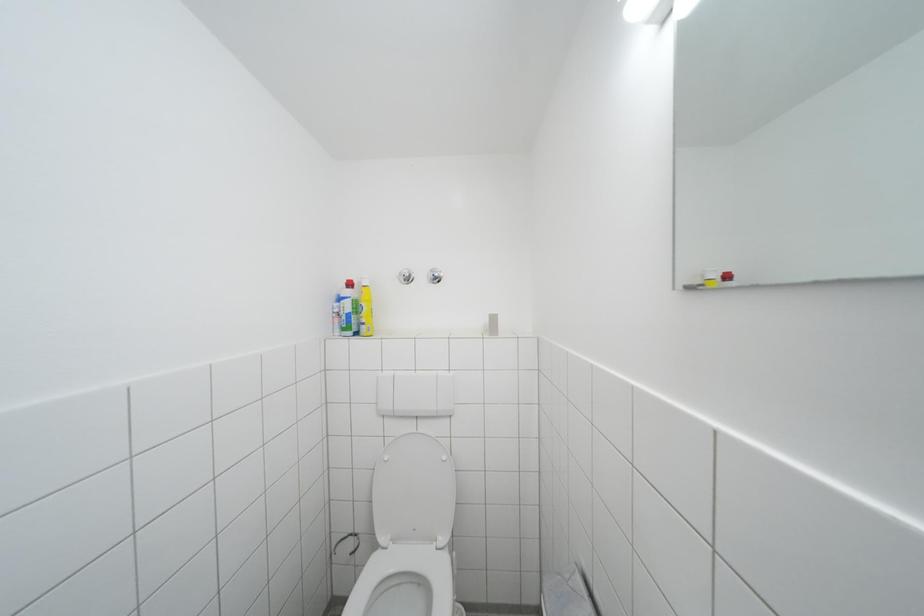
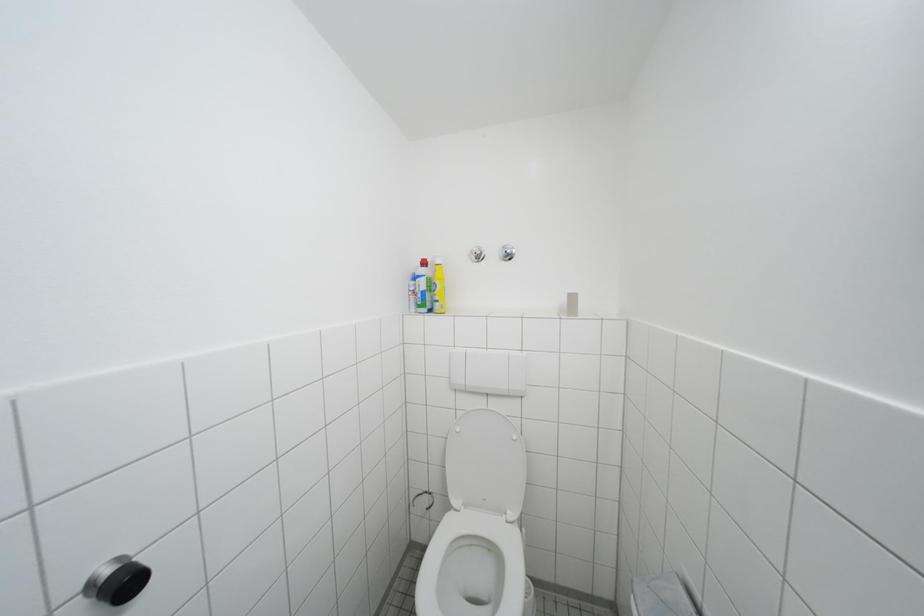
Question: Which direction would the cameraman need to move to produce the second image? Reply with the corresponding letter.

Choices:
 (A) Left
 (B) Right
 (C) Forward
 (D) Backward

Answer: (A)